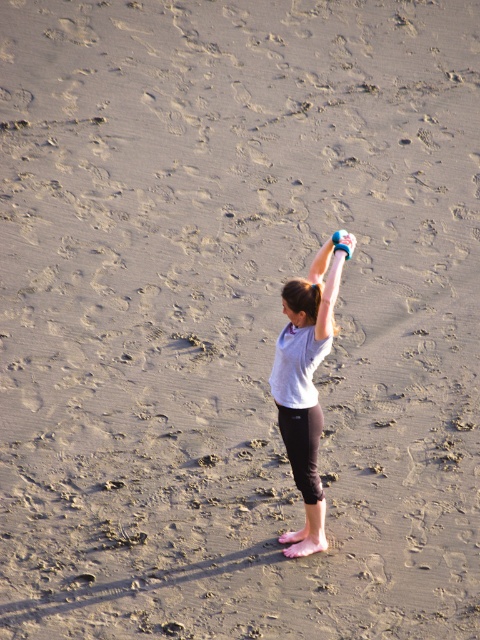
Does blue rubber band at upper center have a smaller size compared to blue rubber glove at upper center?

Actually, blue rubber band at upper center might be larger than blue rubber glove at upper center.

The height and width of the screenshot is (640, 480). What are the coordinates of `blue rubber band at upper center` in the screenshot? It's located at (321, 262).

Which is below, smooth blue dumbbell at upper right or blue rubber band at upper center?

smooth blue dumbbell at upper right is lower down.

Can you confirm if smooth blue dumbbell at upper right is taller than blue rubber band at upper center?

Indeed, smooth blue dumbbell at upper right has a greater height compared to blue rubber band at upper center.

Does point (328, 282) come farther from viewer compared to point (322, 253)?

No, it is in front of (322, 253).

Identify the location of smooth blue dumbbell at upper right. (328, 296).

Does gray fabric shirt at center have a lesser width compared to blue rubber band at upper center?

No.

Can you confirm if gray fabric shirt at center is positioned to the left of blue rubber band at upper center?

Correct, you'll find gray fabric shirt at center to the left of blue rubber band at upper center.

Is point (297, 400) positioned in front of point (324, 262)?

Yes, it is in front of point (324, 262).

At what (x,y) coordinates should I click in order to perform the action: click on gray fabric shirt at center. Please return your answer as a coordinate pair (x, y). This screenshot has width=480, height=640. Looking at the image, I should click on (304, 387).